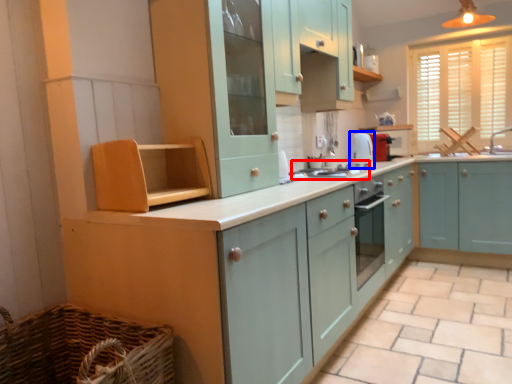
Question: Which object is closer to the camera taking this photo, gas stove (highlighted by a red box) or appliance (highlighted by a blue box)?

Choices:
 (A) gas stove
 (B) appliance

Answer: (A)